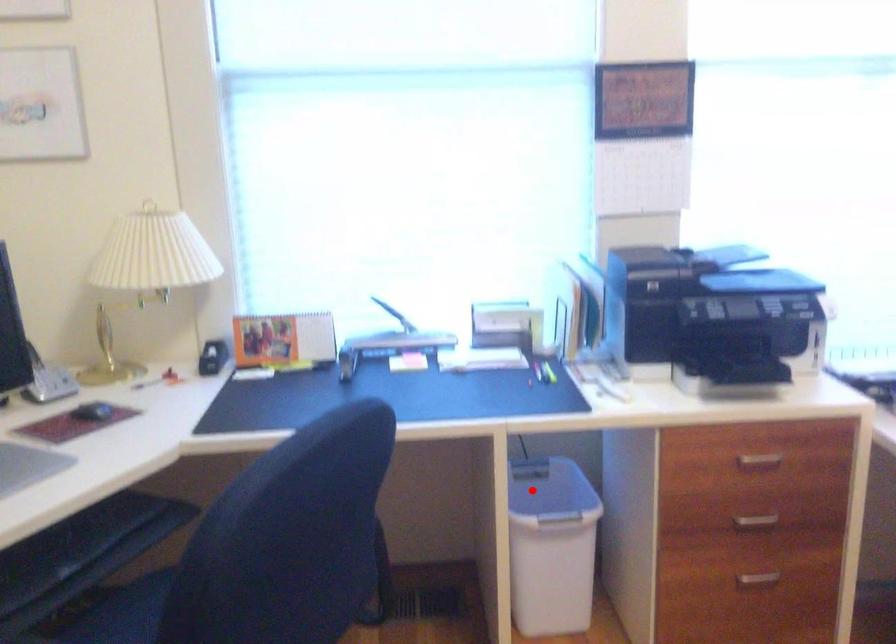
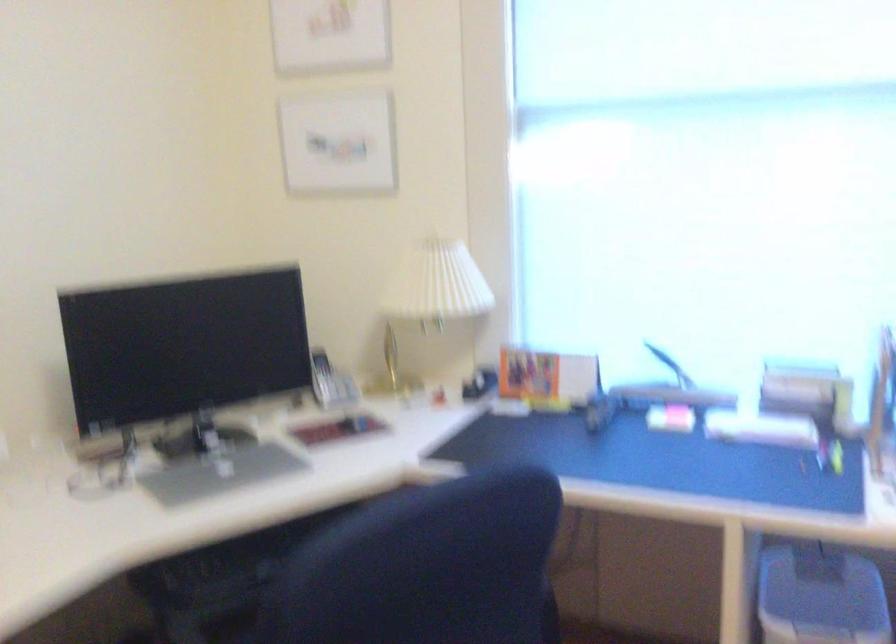
Question: A red point is marked in image1. In image2, is the corresponding 3D point closer to the camera or farther? Reply with the corresponding letter.

Choices:
 (A) The corresponding 3D point is closer.
 (B) The corresponding 3D point is farther.

Answer: (A)